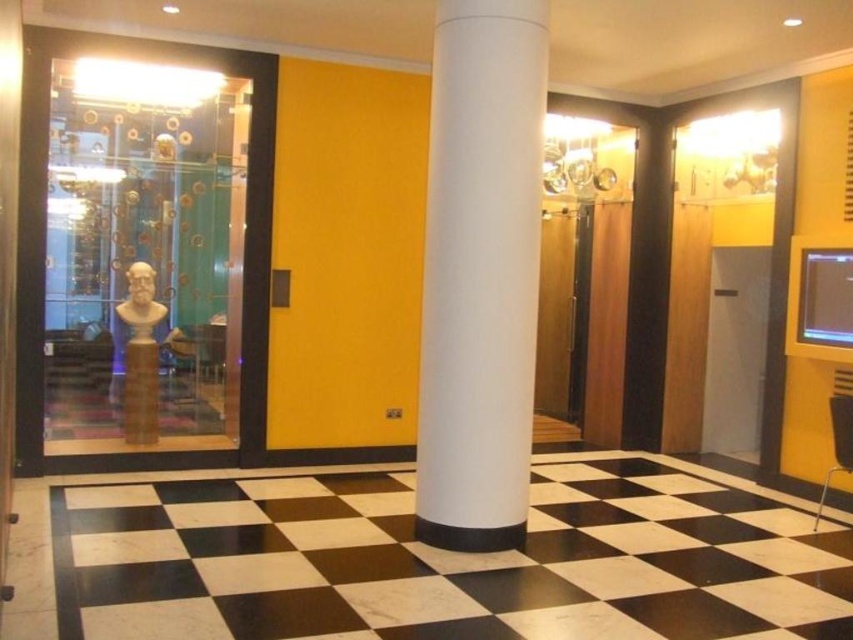
You are a visitor in the museum and want to take a photo of the transparent glass bust at left and the white smooth column at center. Which object will appear larger in your camera viewfinder?

The transparent glass bust at left appears larger in the camera viewfinder because it is closer to the viewer than the white smooth column at center.

You are an art curator preparing to install a new exhibit. You have two bust sculptures, the satin gold bust at left and the matte gold bust at left, which need to be placed on a shelf that is 3.5 inches wide. Can both busts fit side by side on the shelf without overlapping?

The satin gold bust at left and the matte gold bust at left are 3.48 inches apart from each other. Since the shelf is 3.5 inches wide, there is enough space to place both busts side by side without overlapping.

You are an artist planning to photograph the transparent glass bust at left and the white smooth column at center in the museum. Which object should you focus on first if you want to capture the larger subject in your composition?

The transparent glass bust at left is bigger than the white smooth column at center, so you should focus on the transparent glass bust at left first to capture the larger subject.